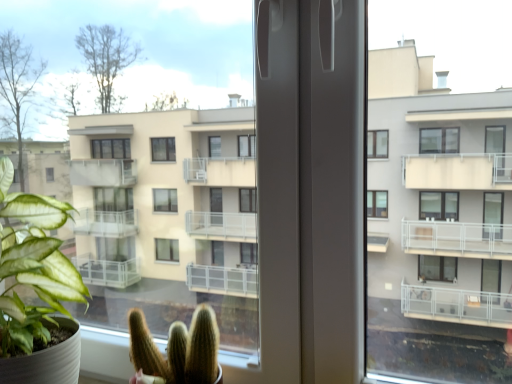
Question: Is green matte cactus at lower center, the 2th houseplant when ordered from left to right, inside or outside of green matte plant at left, arranged as the second houseplant when viewed from the right?

Choices:
 (A) outside
 (B) inside

Answer: (A)

Question: Looking at their shapes, would you say green matte cactus at lower center, the 2th houseplant when ordered from left to right, is wider or thinner than green matte plant at left, arranged as the 1th houseplant when viewed from the left?

Choices:
 (A) wide
 (B) thin

Answer: (B)

Question: From their relative heights in the image, would you say green matte cactus at lower center, acting as the 1th houseplant starting from the right, is taller or shorter than green matte plant at left, arranged as the second houseplant when viewed from the right?

Choices:
 (A) tall
 (B) short

Answer: (B)

Question: From the image's perspective, relative to green matte cactus at lower center, the 2th houseplant when ordered from left to right, is green matte plant at left, arranged as the 1th houseplant when viewed from the left, above or below?

Choices:
 (A) above
 (B) below

Answer: (A)

Question: Is green matte plant at left, arranged as the 1th houseplant when viewed from the left, bigger or smaller than green matte cactus at lower center, the 2th houseplant when ordered from left to right?

Choices:
 (A) big
 (B) small

Answer: (A)

Question: Do you think green matte plant at left, arranged as the second houseplant when viewed from the right, is within green matte cactus at lower center, acting as the 1th houseplant starting from the right, or outside of it?

Choices:
 (A) outside
 (B) inside

Answer: (A)

Question: Is point (34, 230) closer or farther from the camera than point (185, 344)?

Choices:
 (A) closer
 (B) farther

Answer: (B)